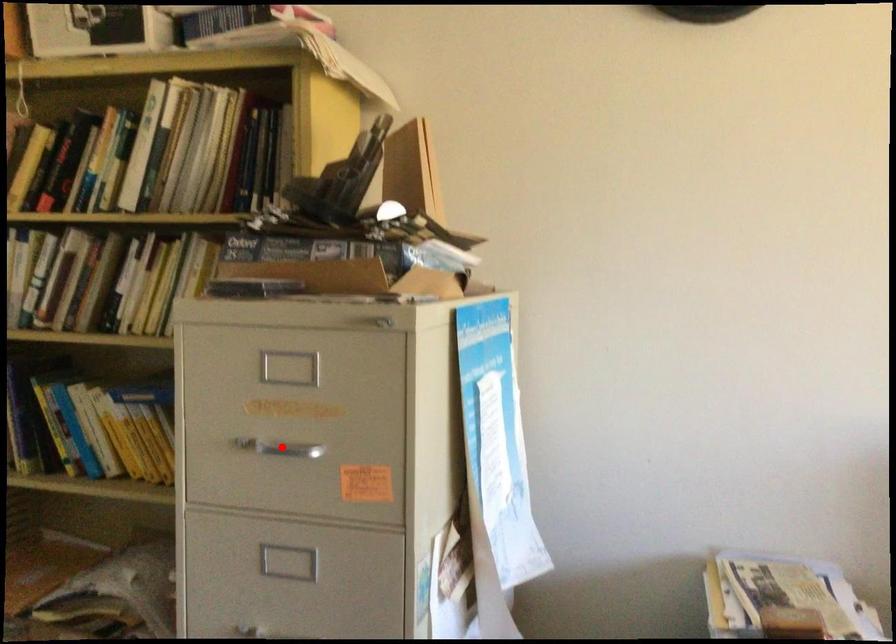
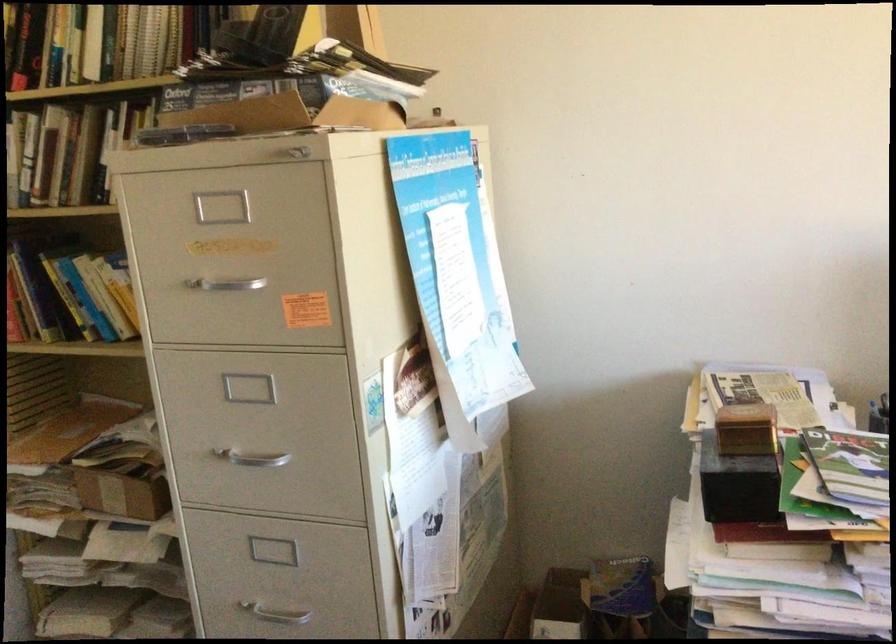
In the second image, find the point that corresponds to the highlighted location in the first image.

(224, 283)